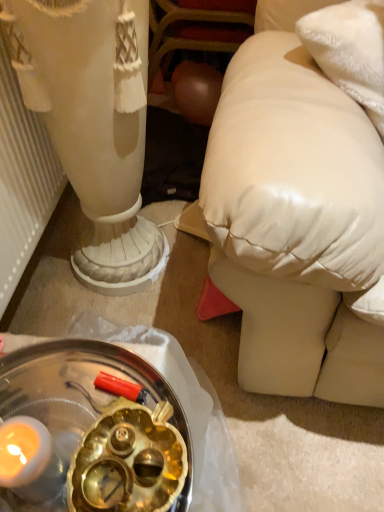
Question: In terms of height, does satin white vase at center look taller or shorter compared to shiny metallic tray at lower left?

Choices:
 (A) short
 (B) tall

Answer: (B)

Question: From the image's perspective, relative to shiny metallic tray at lower left, is satin white vase at center above or below?

Choices:
 (A) above
 (B) below

Answer: (A)

Question: Is satin white vase at center wider or thinner than shiny metallic tray at lower left?

Choices:
 (A) thin
 (B) wide

Answer: (B)

Question: In terms of width, does shiny metallic tray at lower left look wider or thinner when compared to satin white vase at center?

Choices:
 (A) thin
 (B) wide

Answer: (A)

Question: Considering the positions of shiny metallic tray at lower left and satin white vase at center in the image, is shiny metallic tray at lower left bigger or smaller than satin white vase at center?

Choices:
 (A) big
 (B) small

Answer: (B)

Question: Visually, is shiny metallic tray at lower left positioned to the left or to the right of satin white vase at center?

Choices:
 (A) left
 (B) right

Answer: (B)

Question: Is point (180, 458) closer or farther from the camera than point (77, 73)?

Choices:
 (A) farther
 (B) closer

Answer: (B)